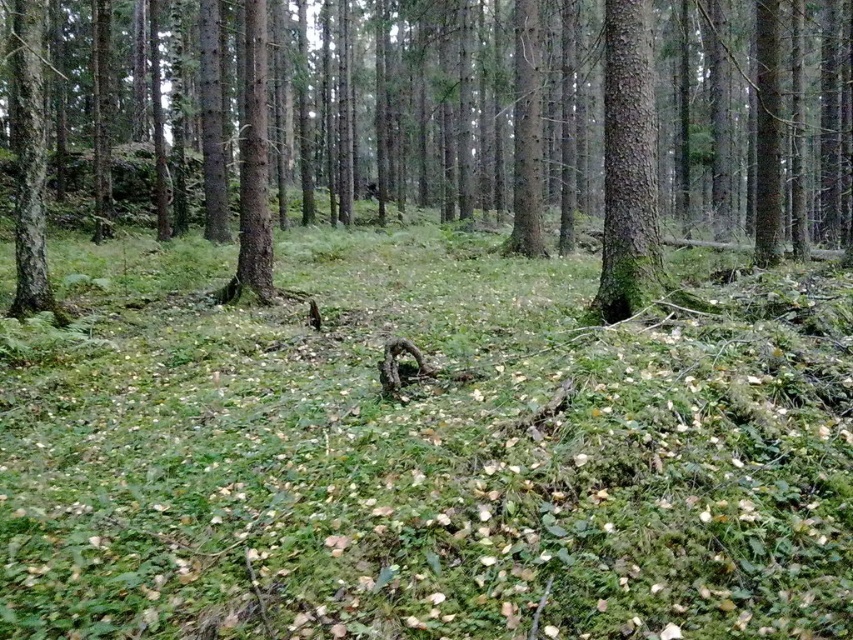
Looking at this image, does green mossy tree trunk at center have a lesser width compared to green mossy tree trunk at left?

Yes.

In the scene shown: Who is more forward, (608, 292) or (35, 312)?

Point (608, 292)

Is point (602, 227) positioned before point (35, 244)?

No.

The width and height of the screenshot is (853, 640). In order to click on green mossy tree trunk at center in this screenshot , I will do `click(628, 166)`.

Can you confirm if brown rough tree at center is taller than green mossy tree trunk at center?

Correct, brown rough tree at center is much taller as green mossy tree trunk at center.

Between brown rough tree at center and green mossy tree trunk at center, which one is positioned higher?

brown rough tree at center is higher up.

Locate an element on the screen. The height and width of the screenshot is (640, 853). brown rough tree at center is located at coordinates (445, 125).

Locate an element on the screen. brown rough tree at center is located at coordinates (445, 125).

Who is higher up, brown rough tree at center or green mossy tree trunk at left?

brown rough tree at center is higher up.

Is brown rough tree at center bigger than green mossy tree trunk at left?

Yes.

Who is more distant from viewer, (759, 248) or (36, 77)?

The point (759, 248) is more distant.

The image size is (853, 640). In order to click on brown rough tree at center in this screenshot , I will do `click(445, 125)`.